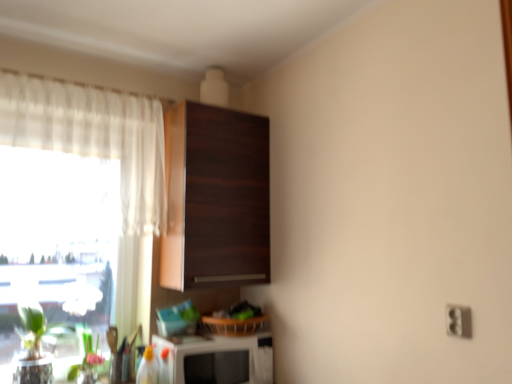
Question: Should I look upward or downward to see white plastic electric outlet at lower right?

Choices:
 (A) up
 (B) down

Answer: (B)

Question: Is green matte plant at lower left surrounding white plastic electric outlet at lower right?

Choices:
 (A) no
 (B) yes

Answer: (A)

Question: Does green matte plant at lower left have a greater width compared to white plastic electric outlet at lower right?

Choices:
 (A) no
 (B) yes

Answer: (B)

Question: Is green matte plant at lower left further to camera compared to white plastic electric outlet at lower right?

Choices:
 (A) no
 (B) yes

Answer: (B)

Question: Is green matte plant at lower left taller than white plastic electric outlet at lower right?

Choices:
 (A) no
 (B) yes

Answer: (B)

Question: Does green matte plant at lower left have a lesser width compared to white plastic electric outlet at lower right?

Choices:
 (A) no
 (B) yes

Answer: (A)

Question: Can you confirm if green matte plant at lower left is shorter than white plastic electric outlet at lower right?

Choices:
 (A) yes
 (B) no

Answer: (B)

Question: Does white plastic electric outlet at lower right have a smaller size compared to green matte plant at lower left?

Choices:
 (A) yes
 (B) no

Answer: (A)

Question: Can you confirm if white plastic electric outlet at lower right is taller than green matte plant at lower left?

Choices:
 (A) no
 (B) yes

Answer: (A)

Question: Is white plastic electric outlet at lower right not within green matte plant at lower left?

Choices:
 (A) yes
 (B) no

Answer: (A)

Question: Is white plastic electric outlet at lower right at the right side of green matte plant at lower left?

Choices:
 (A) yes
 (B) no

Answer: (A)

Question: From a real-world perspective, is white plastic electric outlet at lower right positioned under green matte plant at lower left based on gravity?

Choices:
 (A) yes
 (B) no

Answer: (B)

Question: From the image's perspective, is white plastic electric outlet at lower right on top of green matte plant at lower left?

Choices:
 (A) no
 (B) yes

Answer: (B)

Question: Are white plastic electric outlet at lower right and white sheer curtain at left making contact?

Choices:
 (A) no
 (B) yes

Answer: (A)